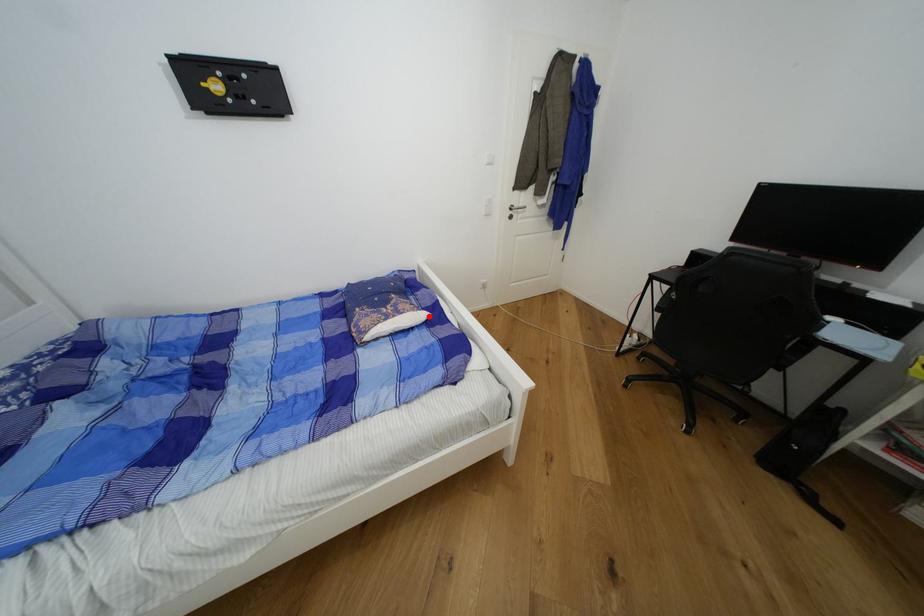
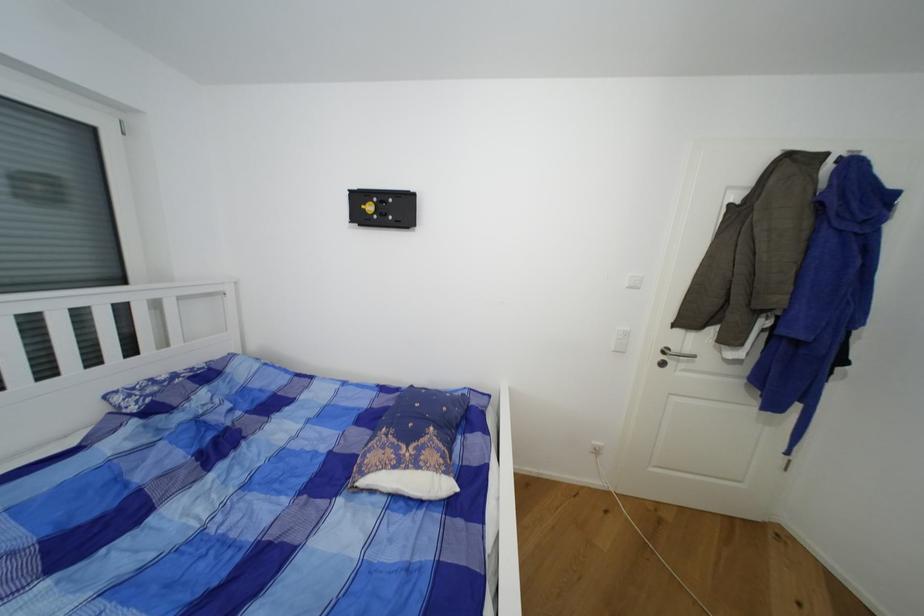
Find the pixel in the second image that matches the highlighted location in the first image.

(454, 488)